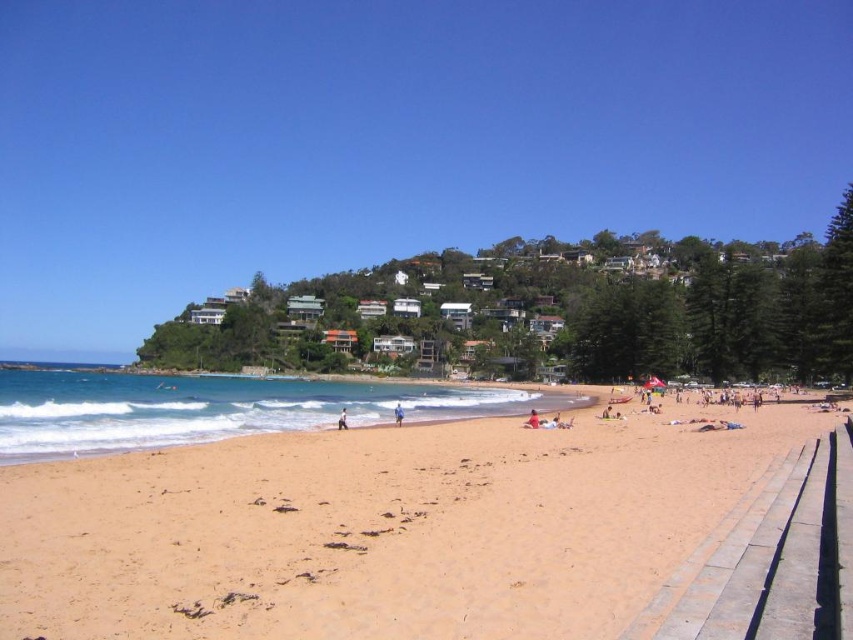
Does green grass at upper center appear under red fabric person at center?

No.

Is green grass at upper center positioned before red fabric person at center?

No, it is behind red fabric person at center.

Find the location of a particular element. Image resolution: width=853 pixels, height=640 pixels. green grass at upper center is located at coordinates pyautogui.click(x=386, y=138).

How much distance is there between green grass at upper center and blue fabric person at lower center?

A distance of 319.45 meters exists between green grass at upper center and blue fabric person at lower center.

Does green grass at upper center have a greater width compared to blue fabric person at lower center?

Indeed, green grass at upper center has a greater width compared to blue fabric person at lower center.

You are a GUI agent. You are given a task and a screenshot of the screen. Output one action in this format:
    pyautogui.click(x=<x>, y=<y>)
    Task: Click on the green grass at upper center
    
    Given the screenshot: What is the action you would take?
    pyautogui.click(x=386, y=138)

Find the location of a particular element. Image resolution: width=853 pixels, height=640 pixels. green grass at upper center is located at coordinates (386, 138).

Is sandy beach at lower left shorter than blue fabric person at lower center?

Yes.

Does sandy beach at lower left have a greater width compared to blue fabric person at lower center?

Correct, the width of sandy beach at lower left exceeds that of blue fabric person at lower center.

Is point (42, 634) closer to viewer compared to point (397, 417)?

Yes, it is.

The image size is (853, 640). I want to click on sandy beach at lower left, so click(x=379, y=529).